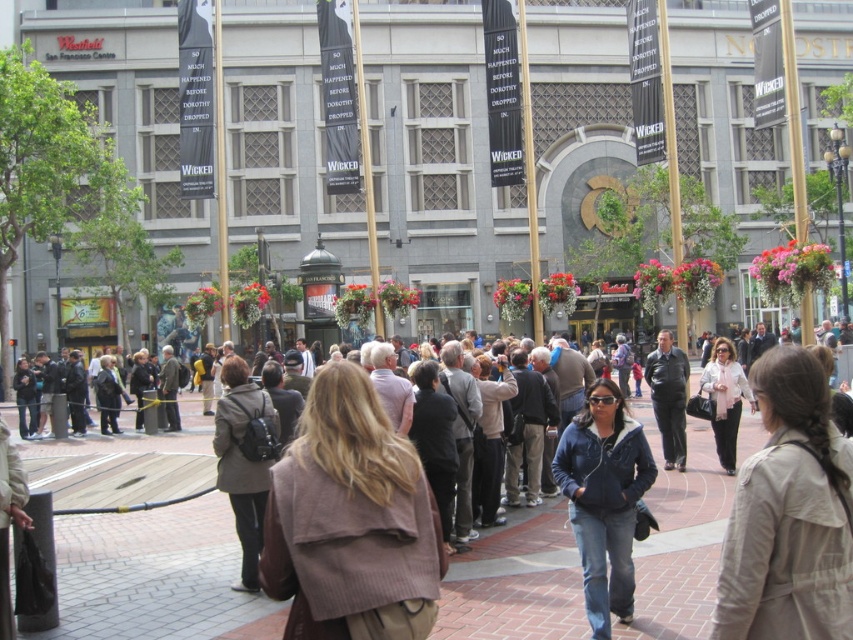
Which is in front, point (751, 637) or point (602, 413)?

Point (751, 637) is in front.

Is light beige coat at center wider than denim jacket at center?

Yes, light beige coat at center is wider than denim jacket at center.

Between point (827, 509) and point (630, 497), which one is positioned behind?

The point (630, 497) is behind.

I want to click on light beige coat at center, so click(788, 515).

Is brick pavement at center bigger than denim jacket at center?

Yes, brick pavement at center is bigger than denim jacket at center.

Who is positioned more to the left, brick pavement at center or denim jacket at center?

brick pavement at center

Who is more forward, (473,582) or (616,413)?

Positioned in front is point (616,413).

The height and width of the screenshot is (640, 853). Find the location of `brick pavement at center`. brick pavement at center is located at coordinates pyautogui.click(x=157, y=579).

Is light beige coat at center behind light pink scarf at center?

That is False.

Between point (850, 612) and point (737, 406), which one is positioned behind?

The point (737, 406) is behind.

Is point (773, 378) more distant than point (715, 436)?

No, it is not.

The width and height of the screenshot is (853, 640). Find the location of `light beige coat at center`. light beige coat at center is located at coordinates (788, 515).